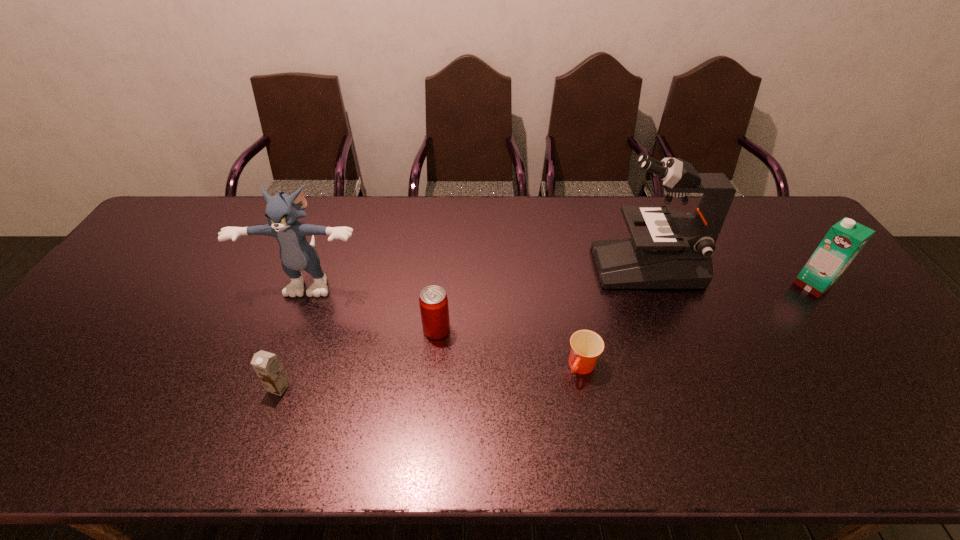
This screenshot has width=960, height=540. Identify the location of the second object from right to left. click(675, 251).

Where is `cat`? This screenshot has height=540, width=960. cat is located at coordinates (282, 211).

This screenshot has width=960, height=540. Identify the location of the fourth shortest object. (845, 239).

Where is `carton`? carton is located at coordinates pyautogui.click(x=845, y=239).

This screenshot has height=540, width=960. Find the location of `the third nearest object`. the third nearest object is located at coordinates (433, 301).

At what (x,y) coordinates should I click in order to perform the action: click on can. Please return your answer as a coordinate pair (x, y). The height and width of the screenshot is (540, 960). Looking at the image, I should click on (433, 301).

You are a GUI agent. You are given a task and a screenshot of the screen. Output one action in this format:
    pyautogui.click(x=<x>, y=<y>)
    Task: Click on the chocolate milk
    The width and height of the screenshot is (960, 540).
    Given the screenshot: What is the action you would take?
    pyautogui.click(x=267, y=366)

At what (x,y) coordinates should I click in order to perform the action: click on the third object from right to left. Please return your answer as a coordinate pair (x, y). Image resolution: width=960 pixels, height=540 pixels. Looking at the image, I should click on (586, 346).

This screenshot has width=960, height=540. What are the coordinates of `cup` in the screenshot? It's located at (586, 346).

At what (x,y) coordinates should I click in order to perform the action: click on free region located through the eyepieces of the fifth object from left to right. Please return your answer as a coordinate pair (x, y). This screenshot has width=960, height=540. Looking at the image, I should click on (533, 266).